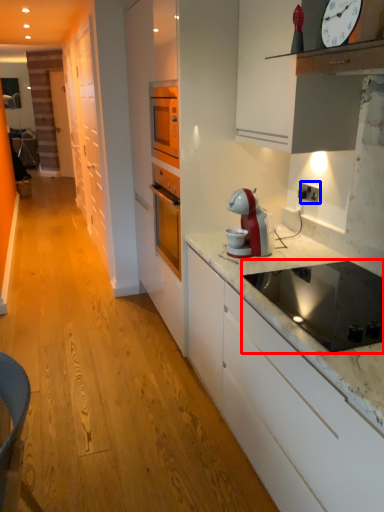
Question: Which object is closer to the camera taking this photo, kitchen appliance (highlighted by a red box) or electric outlet (highlighted by a blue box)?

Choices:
 (A) kitchen appliance
 (B) electric outlet

Answer: (A)